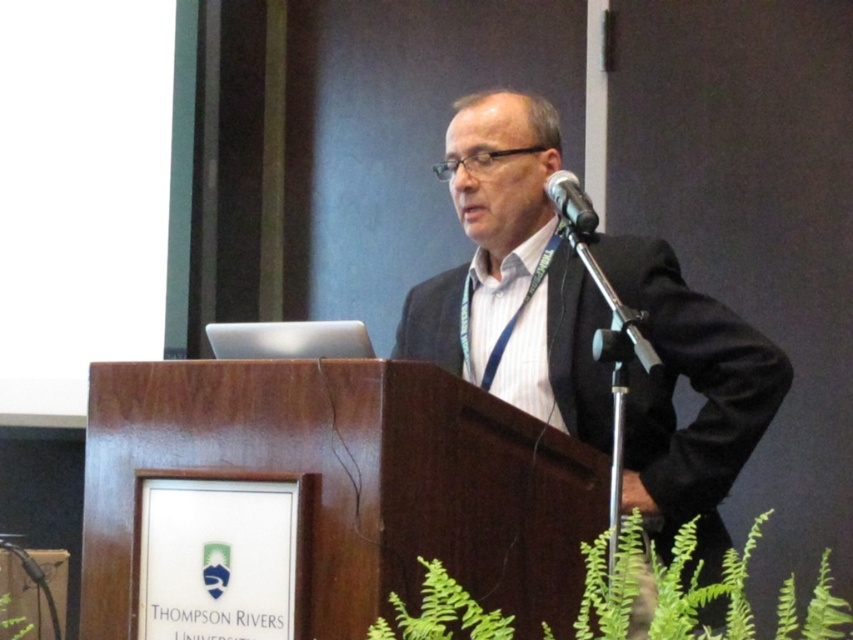
You are a photographer setting up for the presentation. You need to adjust the camera focus so that both the point at point (503,113) and the point at point (590,205) are in focus. Given that the camera can only focus on one plane, which point should you focus on to ensure both are sharp?

You should focus on point (590,205) because it is closer to the camera than point (503,113). This way, the depth of field will extend backward to include the farther point as well.